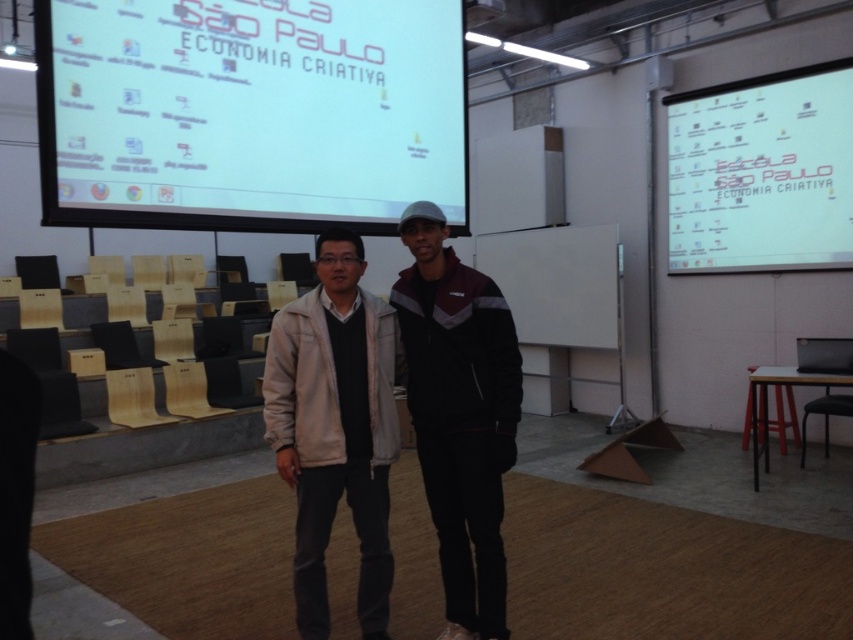
Question: Which of the following is the farthest from the observer?

Choices:
 (A) light beige jacket at center
 (B) white matte projector screen at upper center
 (C) white paper at upper right

Answer: (C)

Question: Estimate the real-world distances between objects in this image. Which object is closer to the white matte projector screen at upper center?

Choices:
 (A) light beige jacket at center
 (B) white paper at upper right

Answer: (A)

Question: Is light beige jacket at center to the right of white paper at upper right from the viewer's perspective?

Choices:
 (A) yes
 (B) no

Answer: (B)

Question: Which point is farther to the camera?

Choices:
 (A) white matte projector screen at upper center
 (B) light beige jacket at center
 (C) white paper at upper right

Answer: (C)

Question: Can you confirm if white matte projector screen at upper center is bigger than white paper at upper right?

Choices:
 (A) yes
 (B) no

Answer: (A)

Question: Can you confirm if white matte projector screen at upper center is bigger than light beige jacket at center?

Choices:
 (A) no
 (B) yes

Answer: (B)